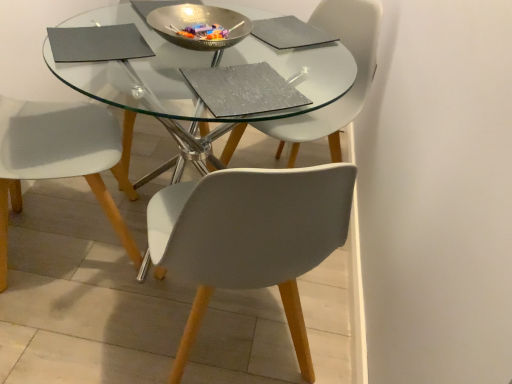
Locate an element on the screen. vacant space in front of white matte chair at lower left, which is the second chair in right-to-left order is located at coordinates (60, 334).